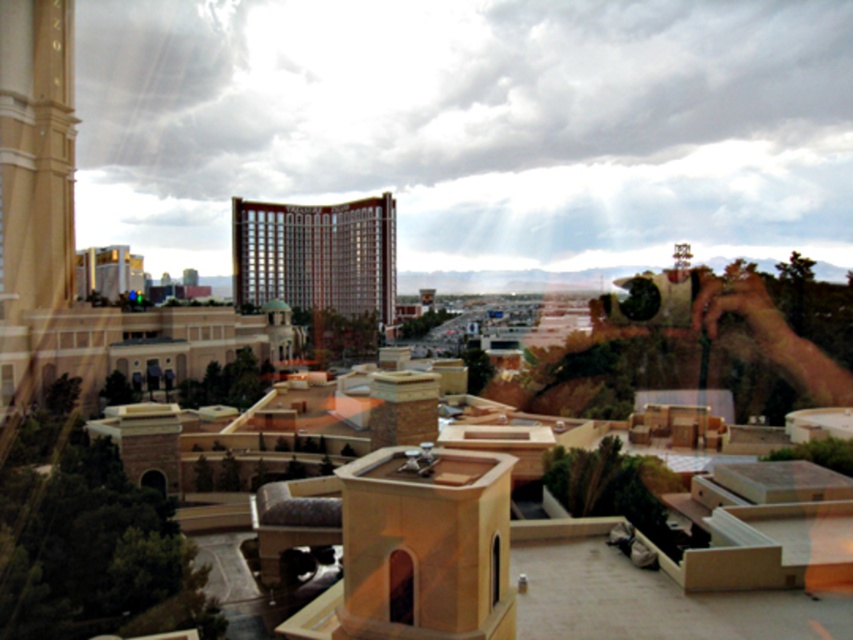
You are an architect evaluating the urban layout. Considering the gold metallic hotel at center and the transparent glass window at upper left, which object occupies more visual space in the scene?

The gold metallic hotel at center has a larger size compared to the transparent glass window at upper left, so it occupies more visual space in the scene.

You are an architect analyzing the building design in the image. You notice two windows, the matte glass window at center and the transparent glass window at upper left. Which window has a smaller height?

The matte glass window at center has a lesser height compared to the transparent glass window at upper left, so the matte glass window at center is smaller in height.